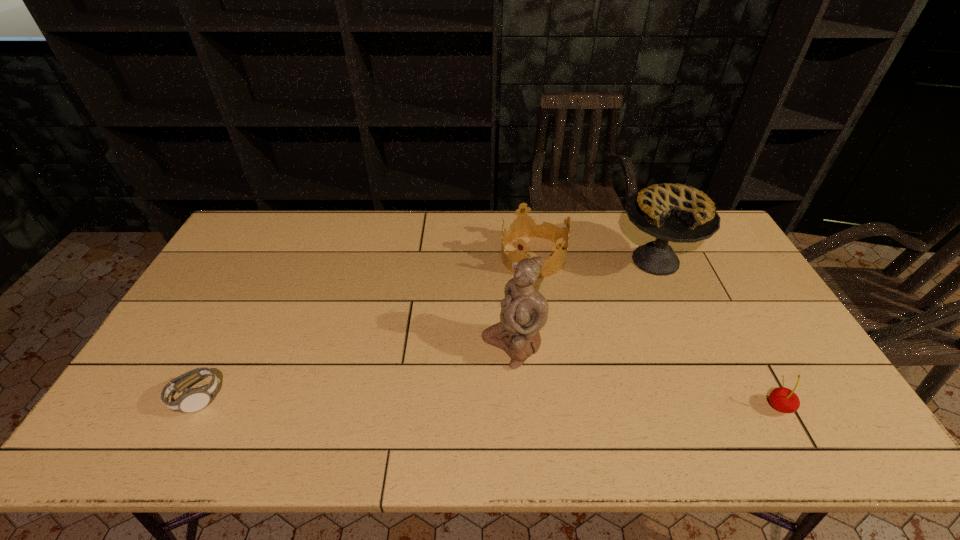
Identify the location of vacant space situated on the front-facing side of the third farthest object. The width and height of the screenshot is (960, 540). (427, 399).

At what (x,y) coordinates should I click in order to perform the action: click on free space located 0.340m on the front-facing side of the tiara. Please return your answer as a coordinate pair (x, y). Looking at the image, I should click on (465, 348).

I want to click on blank space located 0.130m on the front-facing side of the tiara, so click(x=500, y=300).

You are a GUI agent. You are given a task and a screenshot of the screen. Output one action in this format:
    pyautogui.click(x=<x>, y=<y>)
    Task: Click on the free space located 0.370m on the front-facing side of the tiara
    
    Given the screenshot: What is the action you would take?
    point(459,356)

This screenshot has width=960, height=540. In order to click on free space located on the cut side of the pie in this screenshot , I will do `click(616, 323)`.

What are the coordinates of `blank space located 0.100m on the cut side of the pie` in the screenshot? It's located at (630, 302).

You are a GUI agent. You are given a task and a screenshot of the screen. Output one action in this format:
    pyautogui.click(x=<x>, y=<y>)
    Task: Click on the free location located 0.390m on the cut side of the pie
    The width and height of the screenshot is (960, 540).
    Given the screenshot: What is the action you would take?
    (x=589, y=368)

Find the location of a particular element. This screenshot has width=960, height=540. tiara positioned at the far edge is located at coordinates (523, 226).

I want to click on pie at the far edge, so click(x=678, y=213).

Locate an element on the screen. The height and width of the screenshot is (540, 960). watch at the near edge is located at coordinates (192, 400).